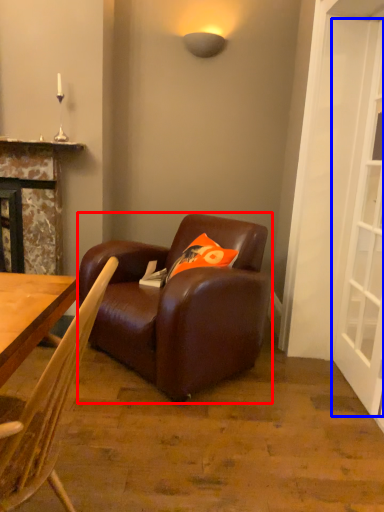
Question: Among these objects, which one is nearest to the camera, studio couch (highlighted by a red box) or screen door (highlighted by a blue box)?

Choices:
 (A) studio couch
 (B) screen door

Answer: (B)